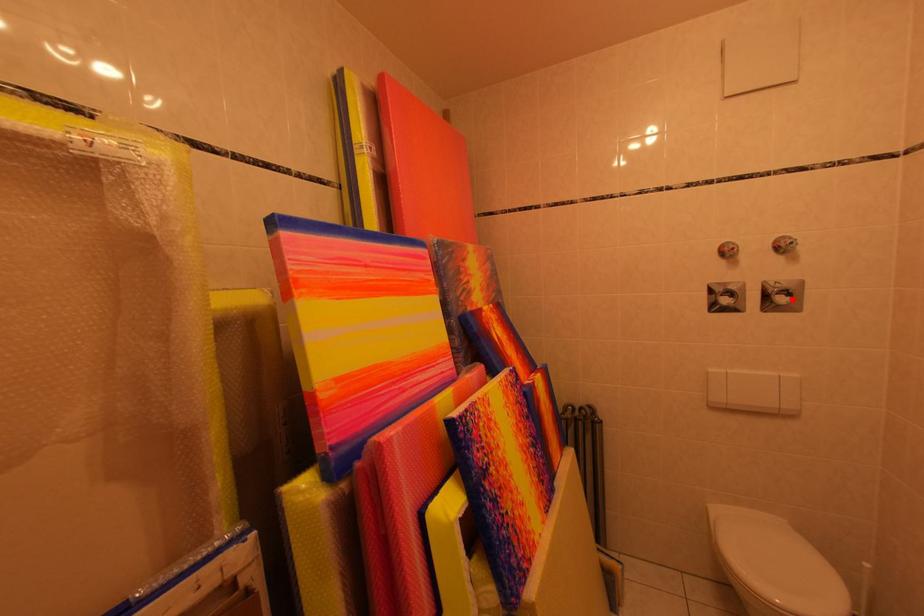
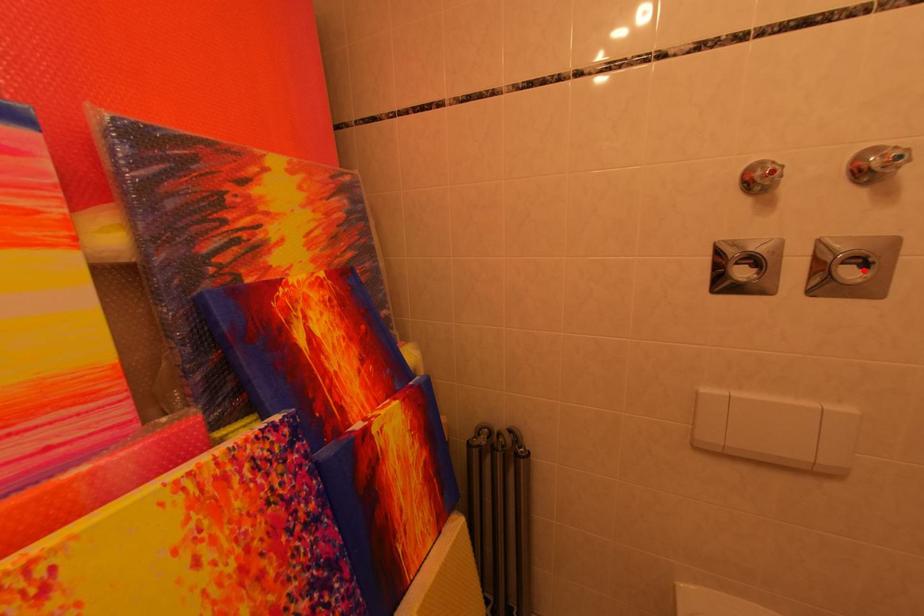
I am providing you with two images of the same scene from different viewpoints. A red point is marked on the first image and another point is marked on the second image. Is the red point in image1 aligned with the point shown in image2?

Yes